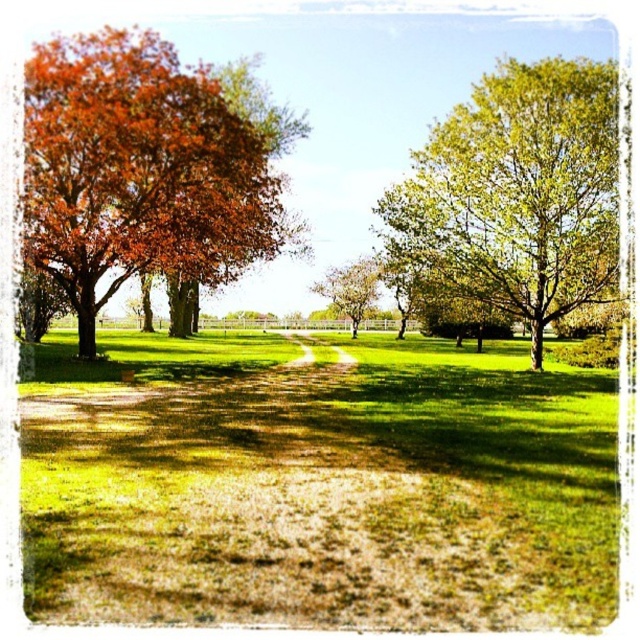
Question: Which of the following is the closest to the observer?

Choices:
 (A) (460, 280)
 (B) (371, 280)
 (C) (145, 52)
 (D) (237, 476)

Answer: (D)

Question: Can you confirm if orange leafy tree at left is thinner than green leafy tree at center?

Choices:
 (A) no
 (B) yes

Answer: (A)

Question: Does green grass at center lie behind orange leafy tree at left?

Choices:
 (A) yes
 (B) no

Answer: (B)

Question: Which of the following is the closest to the observer?

Choices:
 (A) (321, 284)
 (B) (52, 83)

Answer: (B)

Question: Observing the image, what is the correct spatial positioning of green grass at center in reference to orange leafy tree at left?

Choices:
 (A) right
 (B) left

Answer: (A)

Question: Which object is positioned farthest from the green leafy tree at center?

Choices:
 (A) green leafy tree at upper right
 (B) orange leafy tree at left
 (C) green grass at center

Answer: (C)